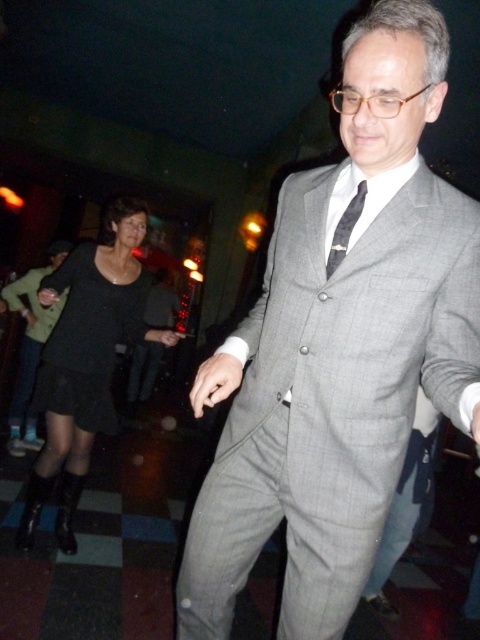
You are trying to navigate through a crowded venue and need to determine which point is closer to you. Given the two points in the scene, point (79, 394) and point (340, 257), which one is closer to your current position?

Point (79, 394) is further to the camera than point (340, 257), so the closer point to your current position is point (340, 257).

You are a fashion designer observing the scene. You need to determine which item is wider between the black matte dress at lower left and the black silk tie at center. Which one is wider?

The black matte dress at lower left is wider than the black silk tie at center according to the description.

You are a photographer standing at the entrance of the venue. You want to capture a photo that includes both the gray wool suit at center and the black matte dress at lower left. Given that your camera has a maximum focus range of 5 feet, will both subjects be in focus?

The distance between the gray wool suit at center and the black matte dress at lower left is 4.92 feet, which is within the camera maximum focus range of 5 feet. Therefore, both subjects will be in focus.